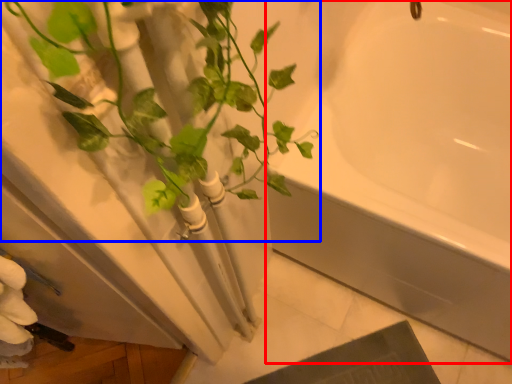
Question: Which point is closer to the camera, bathtub (highlighted by a red box) or houseplant (highlighted by a blue box)?

Choices:
 (A) bathtub
 (B) houseplant

Answer: (B)